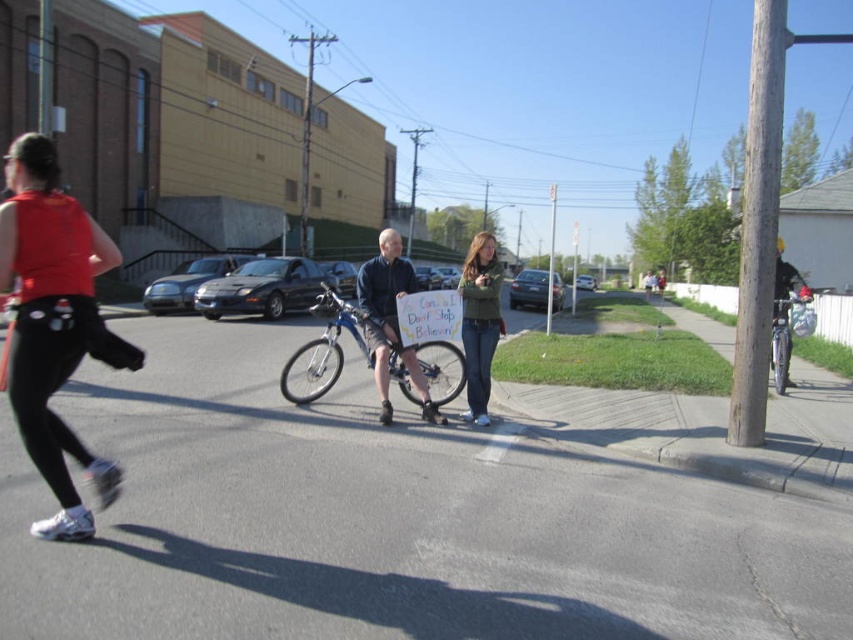
Question: Does matte red tank top at left have a greater width compared to green fuzzy sweater at center?

Choices:
 (A) yes
 (B) no

Answer: (B)

Question: Which is nearer to the green fuzzy sweater at center?

Choices:
 (A) blue metallic bicycle at center
 (B) metallic silver bicycle at right

Answer: (A)

Question: Among these objects, which one is nearest to the camera?

Choices:
 (A) blue denim shorts at center
 (B) blue metallic bicycle at center
 (C) matte red tank top at left
 (D) metallic silver bicycle at right

Answer: (C)

Question: Among these objects, which one is farthest from the camera?

Choices:
 (A) metallic silver bicycle at right
 (B) blue denim shorts at center

Answer: (A)

Question: Is blue denim shorts at center in front of metallic silver bicycle at right?

Choices:
 (A) yes
 (B) no

Answer: (A)

Question: In this image, where is blue denim shorts at center located relative to green fuzzy sweater at center?

Choices:
 (A) below
 (B) above

Answer: (A)